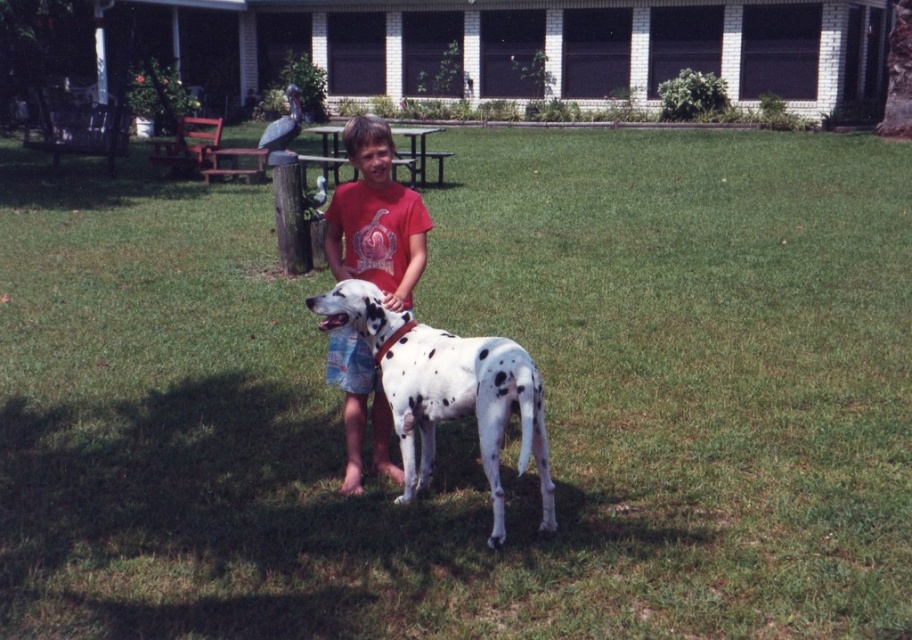
Question: Is white-spotted fur dog at center to the left of matte red t-shirt at center from the viewer's perspective?

Choices:
 (A) no
 (B) yes

Answer: (A)

Question: From the image, what is the correct spatial relationship of white-spotted fur dog at center in relation to matte red t-shirt at center?

Choices:
 (A) right
 (B) left

Answer: (A)

Question: Among these points, which one is nearest to the camera?

Choices:
 (A) (370, 317)
 (B) (344, 339)

Answer: (A)

Question: Is the position of white-spotted fur dog at center more distant than that of matte red t-shirt at center?

Choices:
 (A) no
 (B) yes

Answer: (A)

Question: Which point is closer to the camera?

Choices:
 (A) (355, 400)
 (B) (501, 497)

Answer: (B)